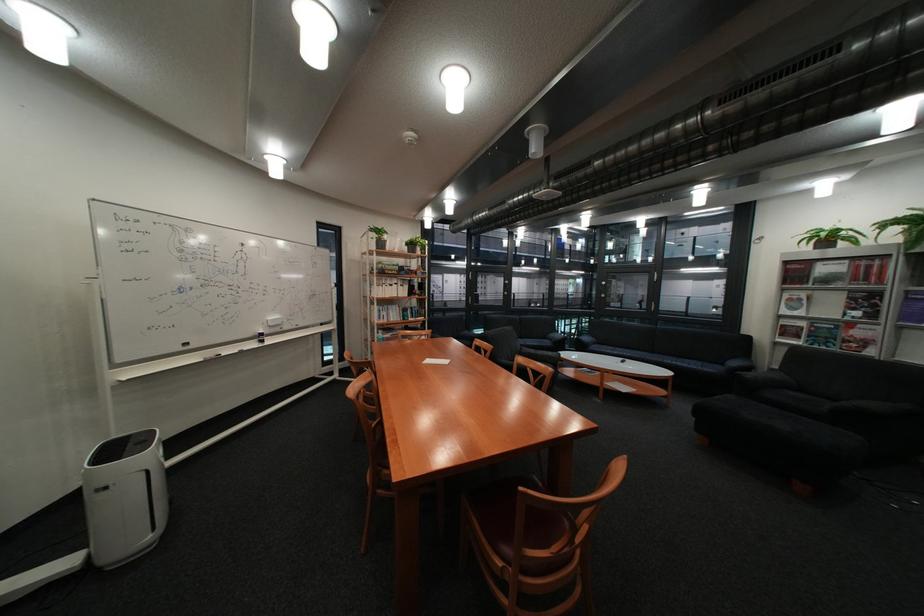
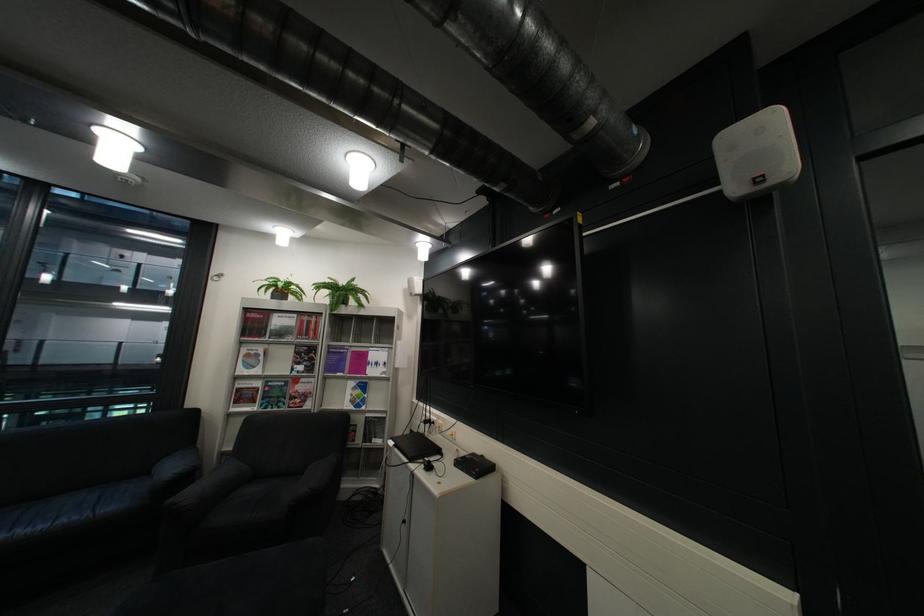
Locate, in the second image, the point that corresponds to the point at 798,326 in the first image.

(254, 390)